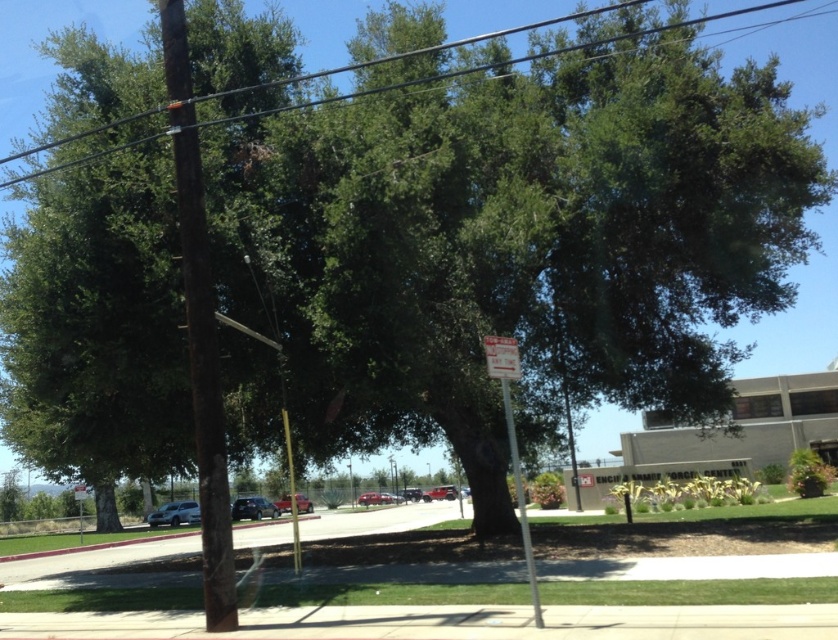
You are standing at the base of the large tree and want to walk to the point marked as point (287, 445) and point (304, 506). Which point will you reach first?

Answer: You will reach point (287, 445) first because it is closer to the viewer than point (304, 506).

You are standing at the point with coordinates point [500,339] and want to walk towards the point with coordinates point [154,516]. Which direction should you face to walk directly towards it?

You should face southeast to walk directly towards point [154,516] from point [500,339].

Based on the scene description, where is the satin silver suv at lower left located in terms of coordinates?

The satin silver suv at lower left is located at coordinates point (174, 513).